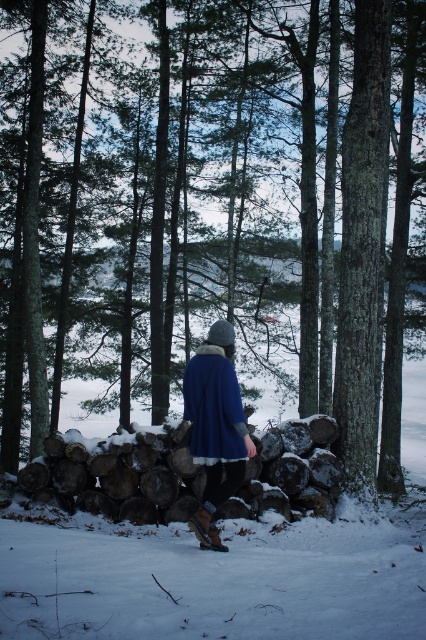
Which is below, snow-covered woodpile at center or blue woolen coat at center?

snow-covered woodpile at center is lower down.

Who is more forward, (324, 426) or (230, 458)?

Positioned in front is point (230, 458).

Does point (195, 492) lie behind point (201, 416)?

Yes.

This screenshot has height=640, width=426. I want to click on snow-covered woodpile at center, so click(117, 476).

Which is above, snow-covered woodpile at center or blue woolen cloak at center?

blue woolen cloak at center is higher up.

Is snow-covered woodpile at center to the right of blue woolen cloak at center from the viewer's perspective?

In fact, snow-covered woodpile at center is to the left of blue woolen cloak at center.

The image size is (426, 640). I want to click on snow-covered woodpile at center, so pos(117,476).

Is point (199, 420) farther from viewer compared to point (216, 397)?

Yes, point (199, 420) is behind point (216, 397).

Can you confirm if blue woolen coat at center is taller than blue woolen cloak at center?

Yes, blue woolen coat at center is taller than blue woolen cloak at center.

Who is more distant from viewer, [203,436] or [218,346]?

Point [218,346]

You are a GUI agent. You are given a task and a screenshot of the screen. Output one action in this format:
    pyautogui.click(x=<x>, y=<y>)
    Task: Click on the blue woolen coat at center
    
    Given the screenshot: What is the action you would take?
    pyautogui.click(x=215, y=426)